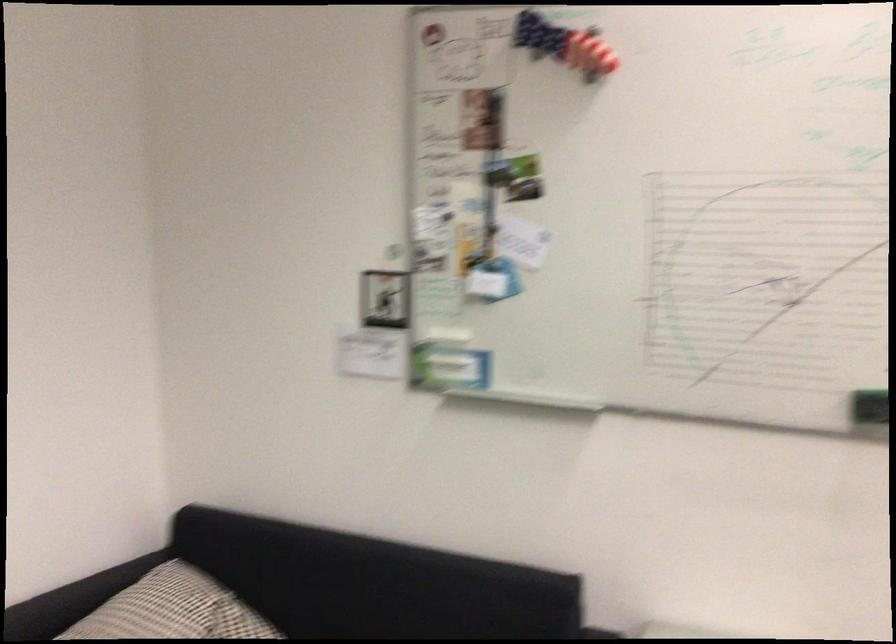
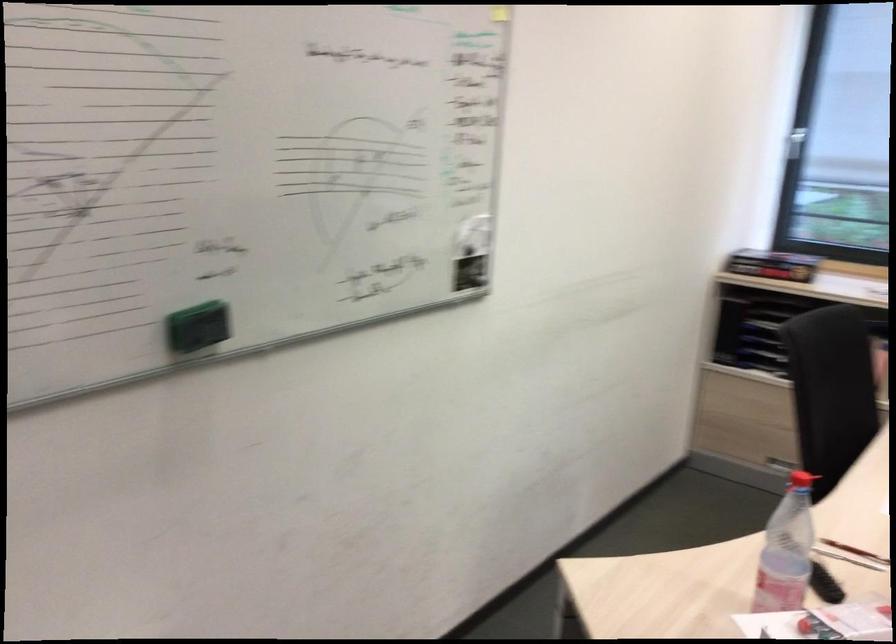
Question: How did the camera likely rotate?

Choices:
 (A) Left
 (B) Right
 (C) Up
 (D) Down

Answer: (B)